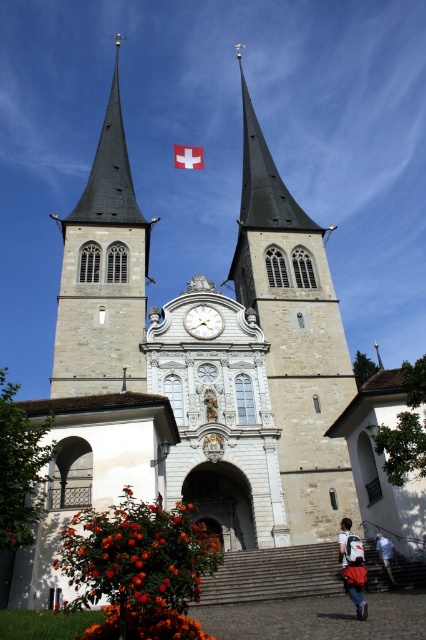
You are a tourist standing in front of the church. You notice the gray stone bell tower at left and the white glossy clock at center. Which object is taller?

The gray stone bell tower at left is taller than the white glossy clock at center.

You are an artist sketching the church and need to ensure proportions are accurate. Which object has a greater width between the white fabric flag at center and the blue fabric pants at lower right?

The white fabric flag at center has a greater width than the blue fabric pants at lower right.